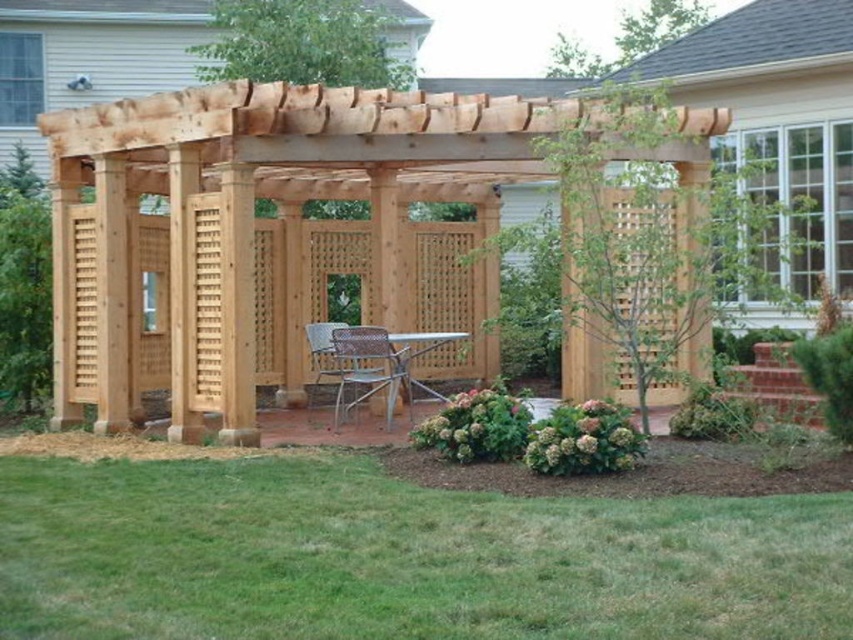
You are standing in the backyard looking at the wooden pergola. There are two points marked on the pergola structure. One is at coordinate point (386, 376) and the other is at point (335, 328). Which of these two points is closer to your current position?

Point (386, 376) is closer to the viewer than point (335, 328).